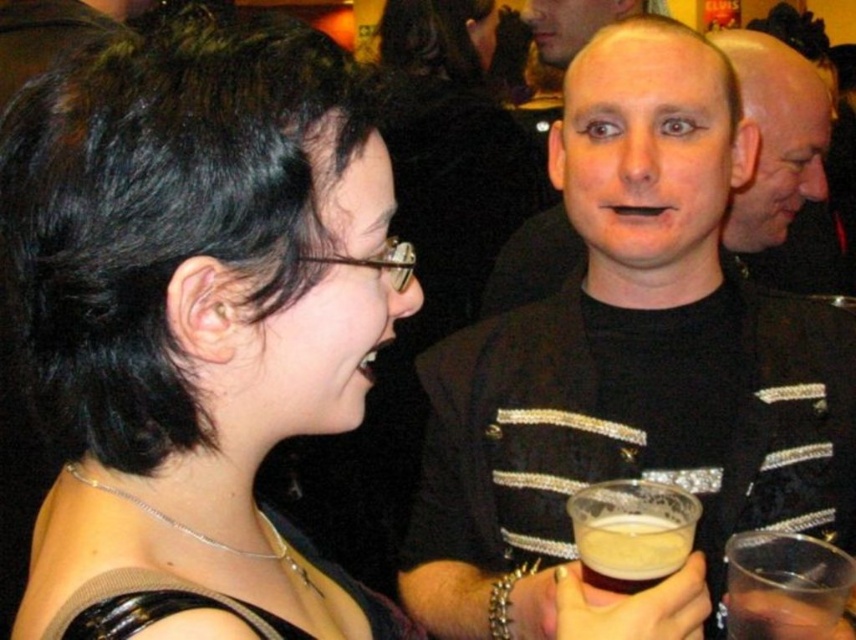
Looking at this image, is matte black jacket at center to the left of translucent plastic cup at lower right from the viewer's perspective?

No, matte black jacket at center is not to the left of translucent plastic cup at lower right.

Which of these two, matte black jacket at center or translucent plastic cup at lower right, stands shorter?

Standing shorter between the two is translucent plastic cup at lower right.

Which is in front, point (765, 230) or point (738, 589)?

Point (738, 589) is in front.

Locate an element on the screen. Image resolution: width=856 pixels, height=640 pixels. matte black jacket at center is located at coordinates (782, 164).

Which is more to the left, matte black jacket at center or smooth bald head at upper right?

smooth bald head at upper right

Is matte black jacket at center above smooth bald head at upper right?

Actually, matte black jacket at center is below smooth bald head at upper right.

The height and width of the screenshot is (640, 856). What do you see at coordinates (782, 164) in the screenshot?
I see `matte black jacket at center` at bounding box center [782, 164].

Identify the location of matte black jacket at center. The height and width of the screenshot is (640, 856). (782, 164).

Between matte black glasses at upper left and matte skin face at upper center, which one has less height?

matte black glasses at upper left

Between matte black glasses at upper left and matte skin face at upper center, which one has more height?

With more height is matte skin face at upper center.

Is point (340, 360) farther from viewer compared to point (571, 12)?

No, (340, 360) is closer to viewer.

What are the coordinates of `matte black glasses at upper left` in the screenshot? It's located at (325, 300).